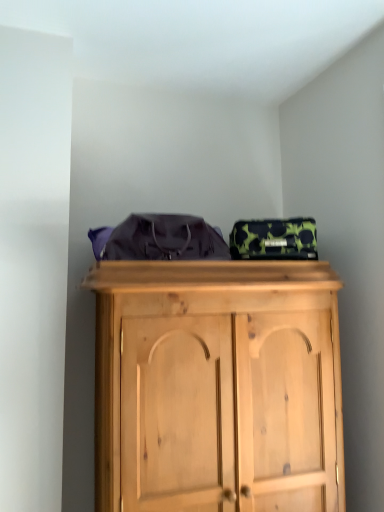
Image resolution: width=384 pixels, height=512 pixels. What are the coordinates of `camouflage-patterned fabric bag at upper center` in the screenshot? It's located at (274, 239).

What do you see at coordinates (274, 239) in the screenshot? I see `camouflage-patterned fabric bag at upper center` at bounding box center [274, 239].

Describe the element at coordinates (164, 239) in the screenshot. This screenshot has height=512, width=384. I see `matte purple bag at center` at that location.

Locate an element on the screen. matte purple bag at center is located at coordinates (164, 239).

What is the approximate width of matte purple bag at center?

matte purple bag at center is 13.66 inches wide.

Locate an element on the screen. camouflage-patterned fabric bag at upper center is located at coordinates (274, 239).

Is camouflage-patterned fabric bag at upper center at the right side of matte purple bag at center?

Correct, you'll find camouflage-patterned fabric bag at upper center to the right of matte purple bag at center.

Which is behind, camouflage-patterned fabric bag at upper center or matte purple bag at center?

camouflage-patterned fabric bag at upper center is further from the camera.

Considering the positions of point (284, 237) and point (175, 224), is point (284, 237) closer or farther from the camera than point (175, 224)?

Point (284, 237).

From the image's perspective, does camouflage-patterned fabric bag at upper center appear higher than matte purple bag at center?

Actually, camouflage-patterned fabric bag at upper center appears below matte purple bag at center in the image.

From a real-world perspective, between camouflage-patterned fabric bag at upper center and matte purple bag at center, who is vertically higher?

matte purple bag at center, from a real-world perspective.

Which of these two, camouflage-patterned fabric bag at upper center or matte purple bag at center, is thinner?

camouflage-patterned fabric bag at upper center is thinner.

Between camouflage-patterned fabric bag at upper center and matte purple bag at center, which one has more height?

With more height is matte purple bag at center.

Considering the relative sizes of camouflage-patterned fabric bag at upper center and matte purple bag at center in the image provided, is camouflage-patterned fabric bag at upper center smaller than matte purple bag at center?

Correct, camouflage-patterned fabric bag at upper center occupies less space than matte purple bag at center.

Is camouflage-patterned fabric bag at upper center positioned beyond the bounds of matte purple bag at center?

Indeed, camouflage-patterned fabric bag at upper center is completely outside matte purple bag at center.

Are camouflage-patterned fabric bag at upper center and matte purple bag at center located far from each other?

No, camouflage-patterned fabric bag at upper center is in close proximity to matte purple bag at center.

Is matte purple bag at center at the back of camouflage-patterned fabric bag at upper center?

camouflage-patterned fabric bag at upper center does not have its back to matte purple bag at center.

Where is `clothing that is above the camouflage-patterned fabric bag at upper center (from the image's perspective)`? The width and height of the screenshot is (384, 512). clothing that is above the camouflage-patterned fabric bag at upper center (from the image's perspective) is located at coordinates (164, 239).

In the scene shown: Visually, is matte purple bag at center positioned to the left or to the right of camouflage-patterned fabric bag at upper center?

Result: Based on their positions, matte purple bag at center is located to the left of camouflage-patterned fabric bag at upper center.

Is the position of matte purple bag at center less distant than that of camouflage-patterned fabric bag at upper center?

Yes, it is in front of camouflage-patterned fabric bag at upper center.

Is point (153, 245) less distant than point (278, 247)?

Yes, it is in front of point (278, 247).

From the image's perspective, would you say matte purple bag at center is positioned over camouflage-patterned fabric bag at upper center?

Yes, from the image's perspective, matte purple bag at center is on top of camouflage-patterned fabric bag at upper center.

From a real-world perspective, which is physically above, matte purple bag at center or camouflage-patterned fabric bag at upper center?

matte purple bag at center.

Does matte purple bag at center have a lesser width compared to camouflage-patterned fabric bag at upper center?

No, matte purple bag at center is not thinner than camouflage-patterned fabric bag at upper center.

Can you confirm if matte purple bag at center is taller than camouflage-patterned fabric bag at upper center?

Yes, matte purple bag at center is taller than camouflage-patterned fabric bag at upper center.

Considering the relative sizes of matte purple bag at center and camouflage-patterned fabric bag at upper center in the image provided, is matte purple bag at center smaller than camouflage-patterned fabric bag at upper center?

No, matte purple bag at center is not smaller than camouflage-patterned fabric bag at upper center.

Is camouflage-patterned fabric bag at upper center completely or partially inside matte purple bag at center?

No, camouflage-patterned fabric bag at upper center is not inside matte purple bag at center.

Is matte purple bag at center far away from camouflage-patterned fabric bag at upper center?

No, matte purple bag at center is in close proximity to camouflage-patterned fabric bag at upper center.

Is camouflage-patterned fabric bag at upper center at the back of matte purple bag at center?

That's not correct — matte purple bag at center is not looking away from camouflage-patterned fabric bag at upper center.

What's the angular difference between matte purple bag at center and camouflage-patterned fabric bag at upper center's facing directions?

matte purple bag at center and camouflage-patterned fabric bag at upper center are facing 0.00399 degrees away from each other.

Locate an element on the screen. The width and height of the screenshot is (384, 512). clothing in front of the camouflage-patterned fabric bag at upper center is located at coordinates (164, 239).

I want to click on bag on the right of matte purple bag at center, so click(274, 239).

At what (x,y) coordinates should I click in order to perform the action: click on clothing in front of the camouflage-patterned fabric bag at upper center. Please return your answer as a coordinate pair (x, y). Looking at the image, I should click on (164, 239).